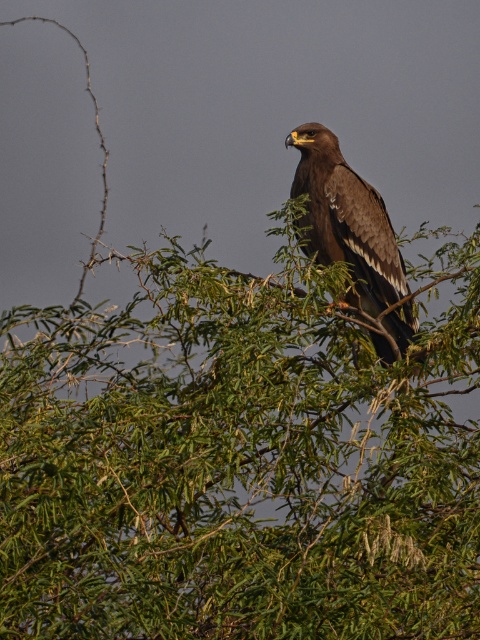
Does green leafy tree at upper center have a lesser width compared to brown feathered eagle at center?

No.

In the scene shown: Can you confirm if green leafy tree at upper center is positioned to the right of brown feathered eagle at center?

Incorrect, green leafy tree at upper center is not on the right side of brown feathered eagle at center.

Is point (10, 612) positioned before point (319, 250)?

That is True.

Where is `green leafy tree at upper center`? The height and width of the screenshot is (640, 480). green leafy tree at upper center is located at coordinates (239, 460).